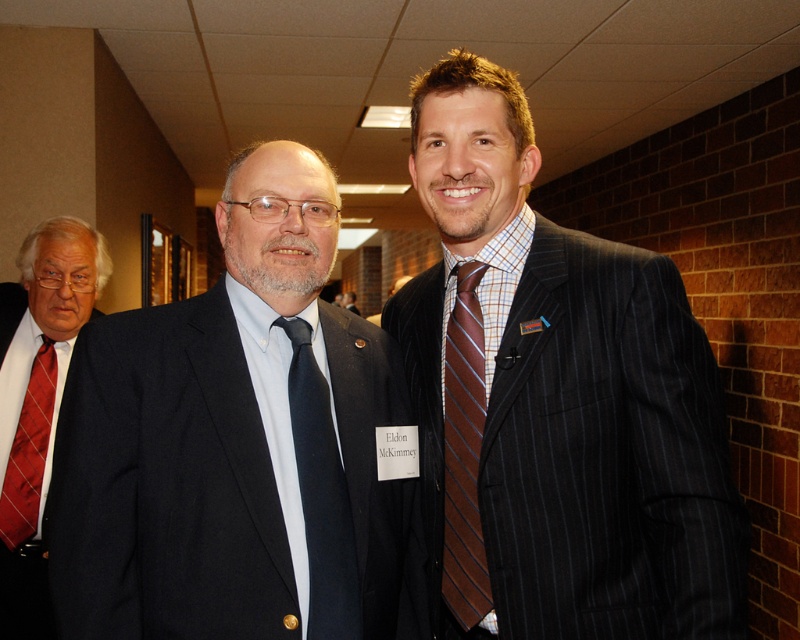
Question: Is matte black tie at center above red satin tie at left?

Choices:
 (A) no
 (B) yes

Answer: (B)

Question: Which point is closer to the camera?

Choices:
 (A) (140, 381)
 (B) (728, 552)
 (C) (64, 260)

Answer: (A)

Question: Is the position of red textured tie at left more distant than that of brown striped tie at center?

Choices:
 (A) yes
 (B) no

Answer: (A)

Question: From the image, what is the correct spatial relationship of brown striped tie at center in relation to red satin tie at left?

Choices:
 (A) right
 (B) left

Answer: (A)

Question: Among these objects, which one is nearest to the camera?

Choices:
 (A) matte black tie at center
 (B) brown striped tie at center
 (C) red satin tie at left

Answer: (A)

Question: Which point appears farthest from the camera in this image?

Choices:
 (A) pyautogui.click(x=36, y=404)
 (B) pyautogui.click(x=449, y=74)
 (C) pyautogui.click(x=300, y=413)
 (D) pyautogui.click(x=66, y=356)

Answer: (D)